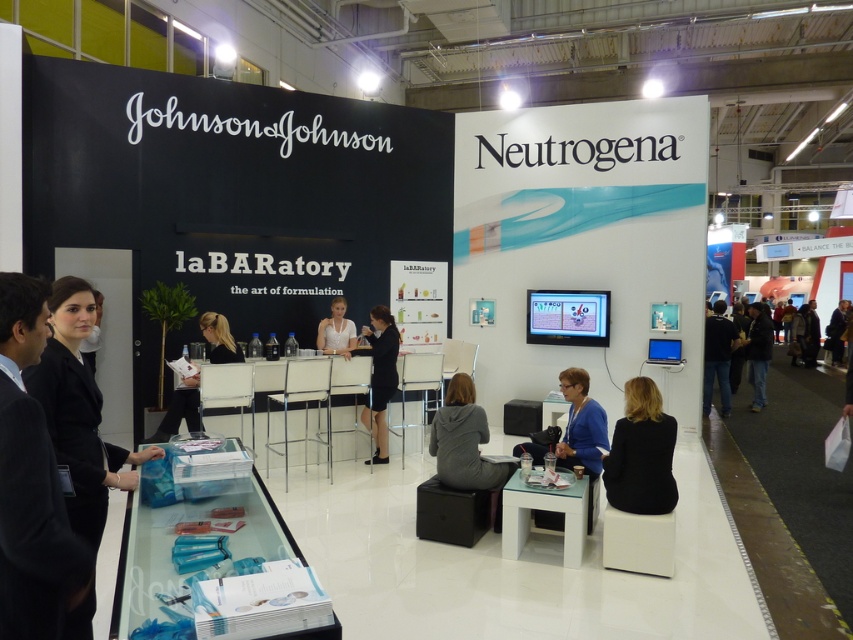
You are an event decorator at the Johnson and Johnson booth. You need to hang a new banner that requires 3 meters of black fabric. You have two options available at the booth, the black fabric at left and the black fabric coat at lower right. Which one do you think will provide enough fabric for the banner?

The black fabric at left has a larger width than the black fabric coat at lower right, so it will provide enough fabric for the banner.

You are a photographer setting up for a photoshoot at the Johnson and Johnson Neutrogena booth. You need to position both the gray hoodie at center and the white matte shirt at center in the frame. Which item should you place closer to the camera to ensure both fit within the shot?

Since the gray hoodie at center occupies less space than the white matte shirt at center, you should place the white matte shirt at center closer to the camera. This will make it appear larger in the frame, balancing their sizes so both fit well within the shot.